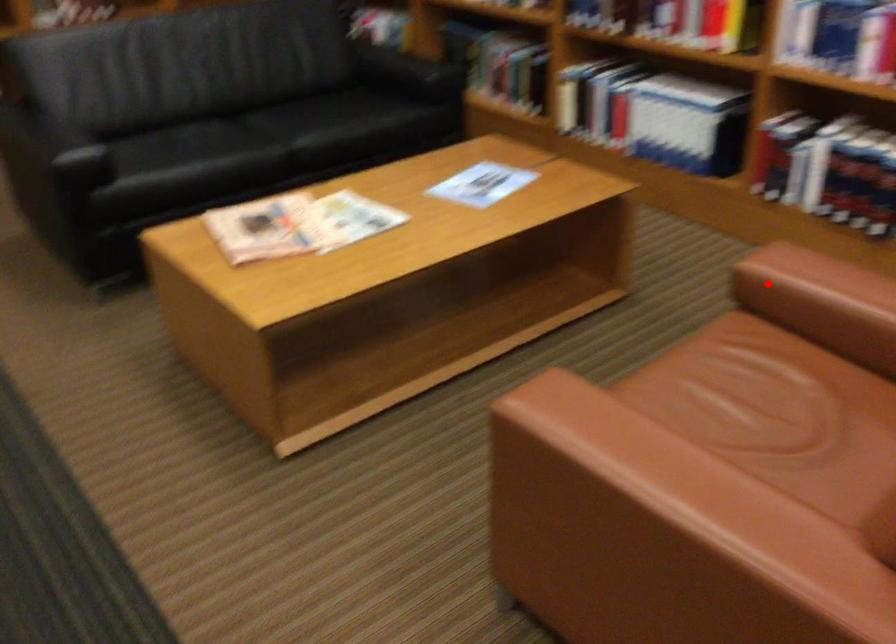
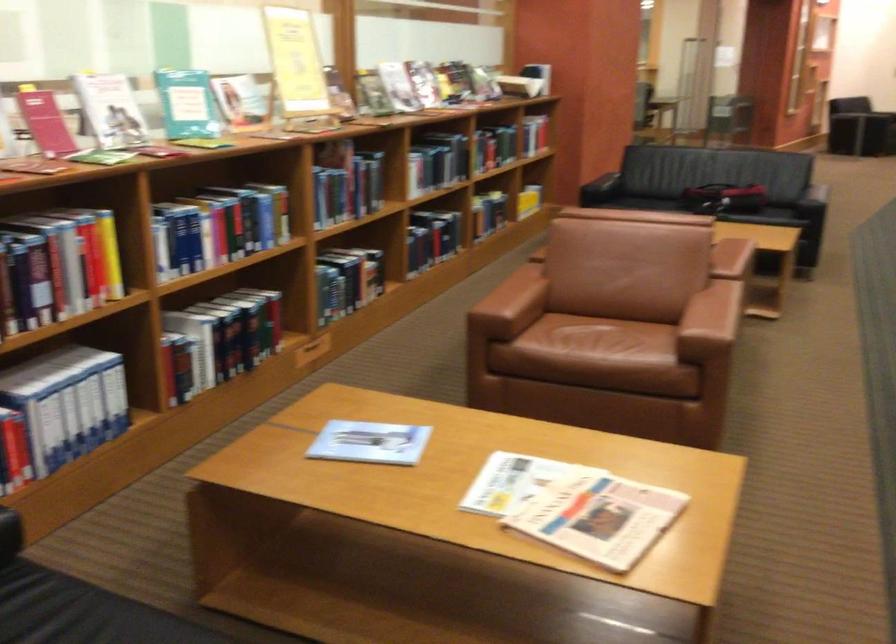
Question: I am providing you with two images of the same scene from different viewpoints. A red point is marked on the first image. Is the red point's position out of view in image 2?

Choices:
 (A) Yes
 (B) No

Answer: (B)